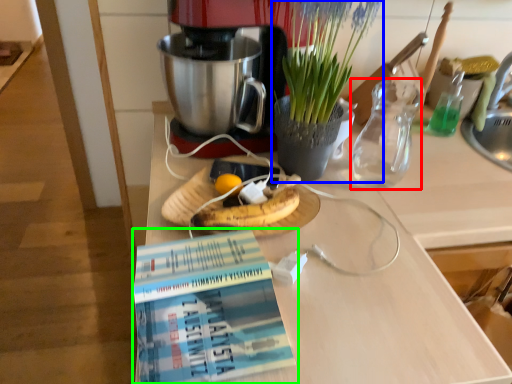
Question: Which is nearer to the tea pot (highlighted by a red box)? houseplant (highlighted by a blue box) or book (highlighted by a green box).

Choices:
 (A) houseplant
 (B) book

Answer: (A)